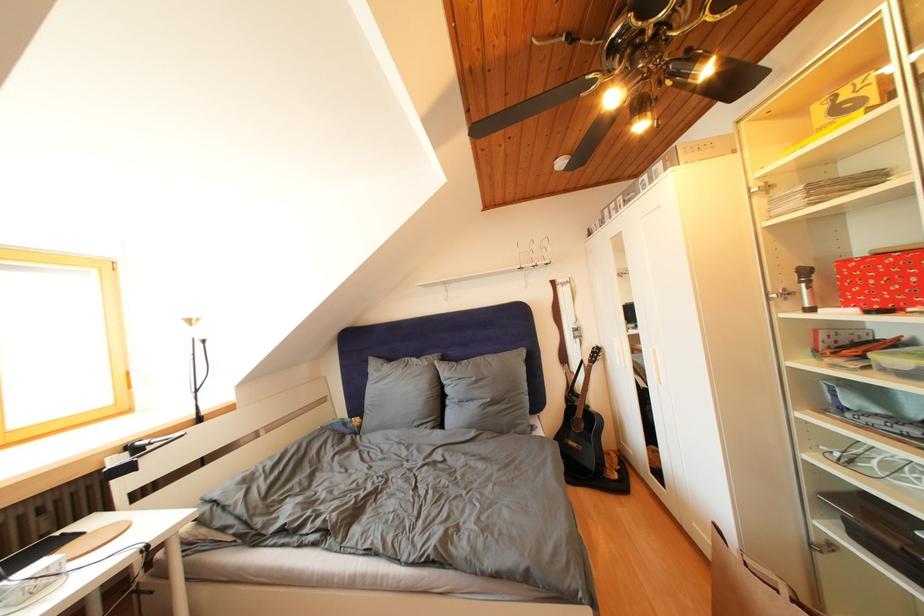
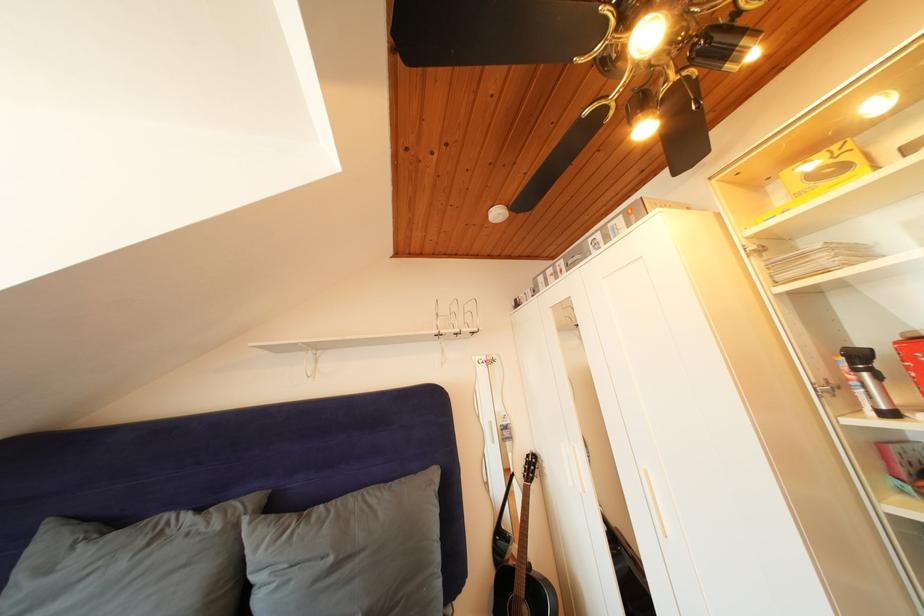
Find the pixel in the second image that matches [588,419] in the first image.

(528, 592)